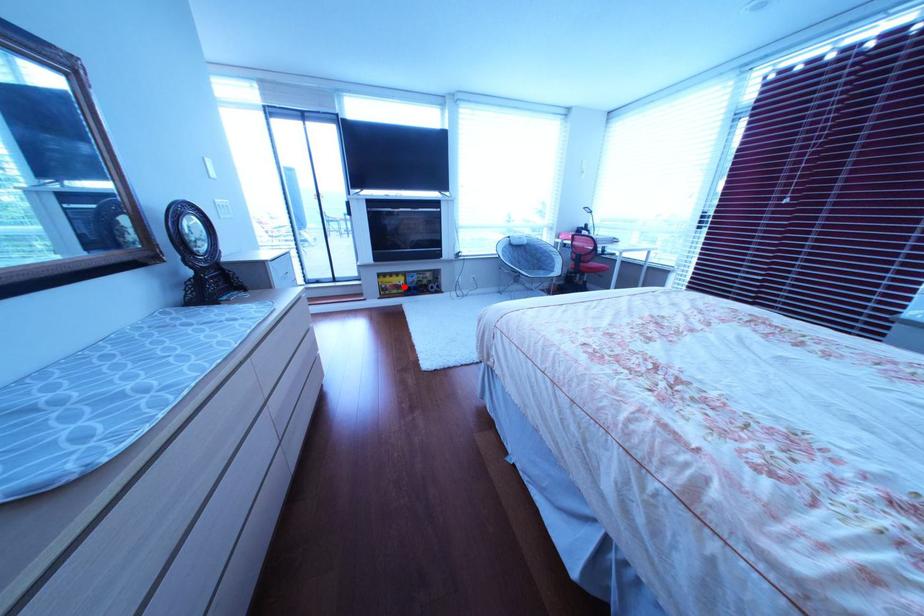
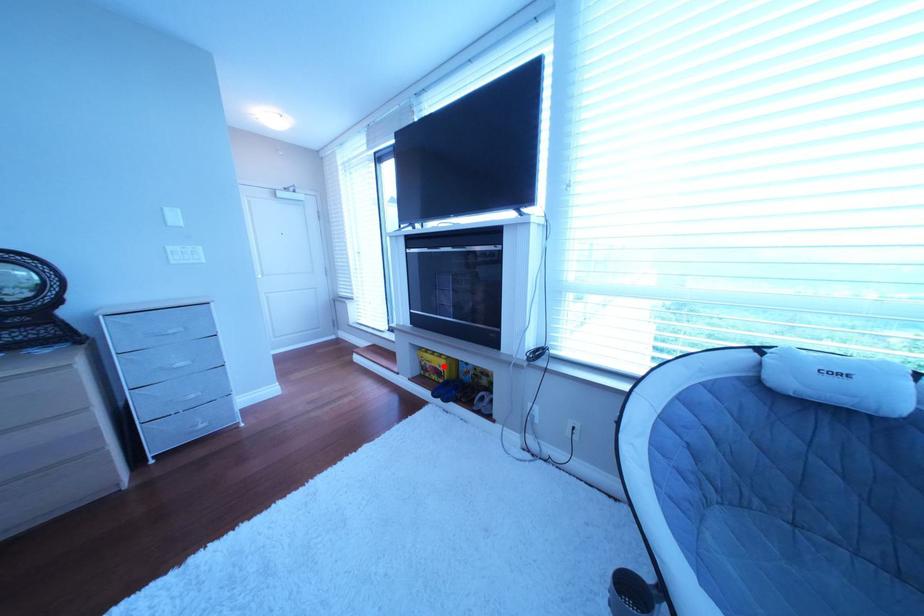
I am providing you with two images of the same scene from different viewpoints. A red point is marked on the first image and another point is marked on the second image. Do the highlighted points in image1 and image2 indicate the same real-world spot?

Yes